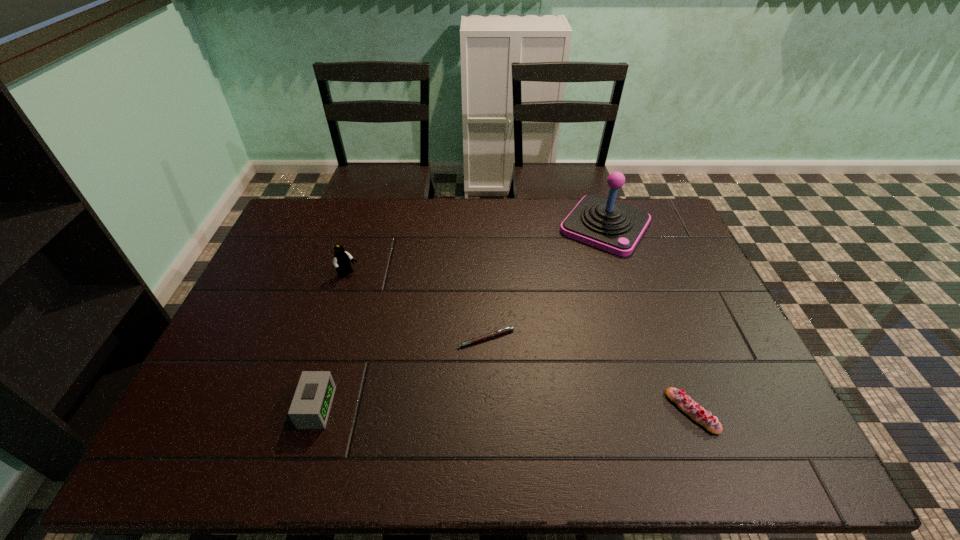
Locate an element on the screen. The image size is (960, 540). alarm clock is located at coordinates (311, 404).

Locate an element on the screen. the fourth tallest object is located at coordinates (696, 412).

Locate an element on the screen. The image size is (960, 540). the third nearest object is located at coordinates (502, 331).

At what (x,y) coordinates should I click in order to perform the action: click on the third object from left to right. Please return your answer as a coordinate pair (x, y). Image resolution: width=960 pixels, height=540 pixels. Looking at the image, I should click on (502, 331).

This screenshot has height=540, width=960. What are the coordinates of `the tallest object` in the screenshot? It's located at (603, 223).

At what (x,y) coordinates should I click in order to perform the action: click on the farthest object. Please return your answer as a coordinate pair (x, y). This screenshot has width=960, height=540. Looking at the image, I should click on (603, 223).

Identify the location of the fourth nearest object. The width and height of the screenshot is (960, 540). (341, 261).

Identify the location of the second tallest object. (341, 261).

The height and width of the screenshot is (540, 960). I want to click on vacant space located on the front-facing side of the third tallest object, so click(x=390, y=408).

Where is `free region located on the back of the fourth tallest object`? This screenshot has height=540, width=960. free region located on the back of the fourth tallest object is located at coordinates (675, 366).